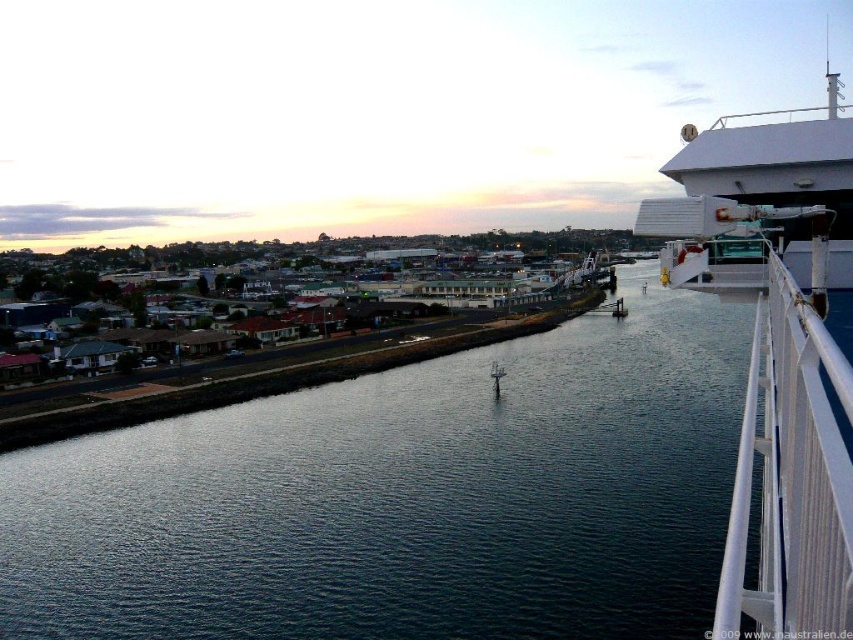
Question: Among these objects, which one is farthest from the camera?

Choices:
 (A) white textured rail at right
 (B) dark blue water at center
 (C) white matte cruise ship at upper right

Answer: (B)

Question: Does dark blue water at center have a smaller size compared to white matte cruise ship at upper right?

Choices:
 (A) no
 (B) yes

Answer: (B)

Question: Considering the real-world distances, which object is closest to the white matte cruise ship at upper right?

Choices:
 (A) dark blue water at center
 (B) white textured rail at right

Answer: (B)

Question: In this image, where is dark blue water at center located relative to white textured rail at right?

Choices:
 (A) above
 (B) below

Answer: (A)

Question: Which point is closer to the camera taking this photo?

Choices:
 (A) (741, 168)
 (B) (787, 516)

Answer: (B)

Question: Is white textured rail at right bigger than white matte cruise ship at upper right?

Choices:
 (A) yes
 (B) no

Answer: (B)